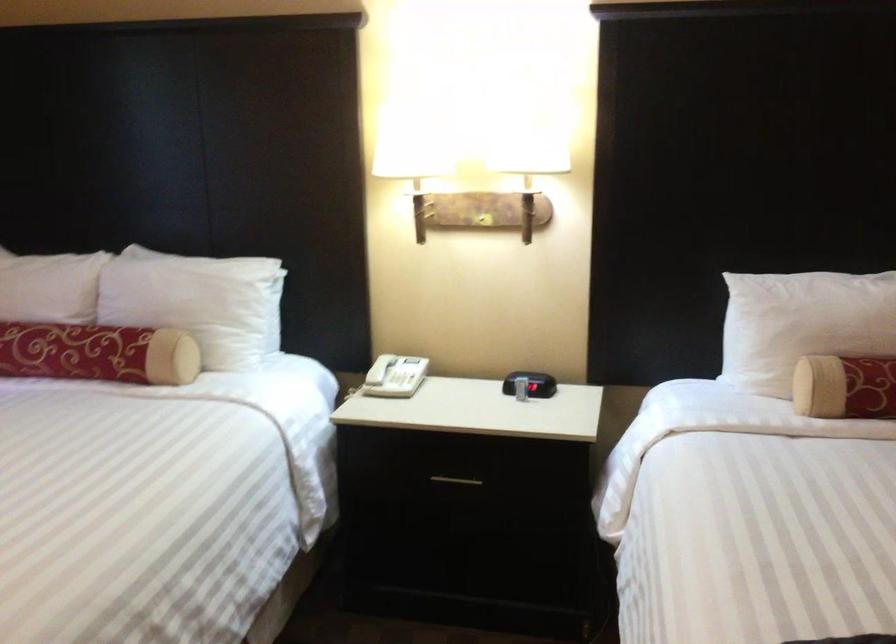
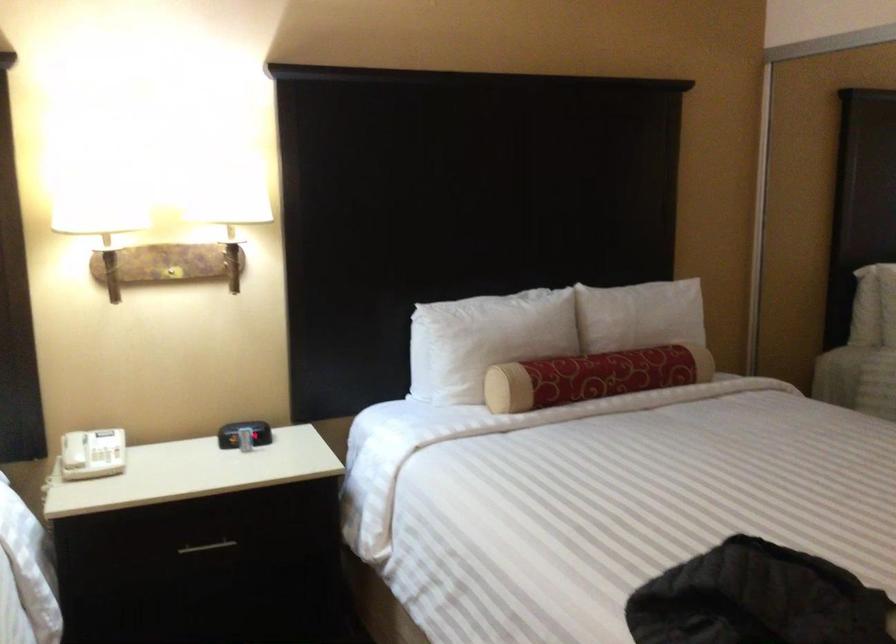
Locate, in the second image, the point that corresponds to point 522,381 in the first image.

(244, 433)